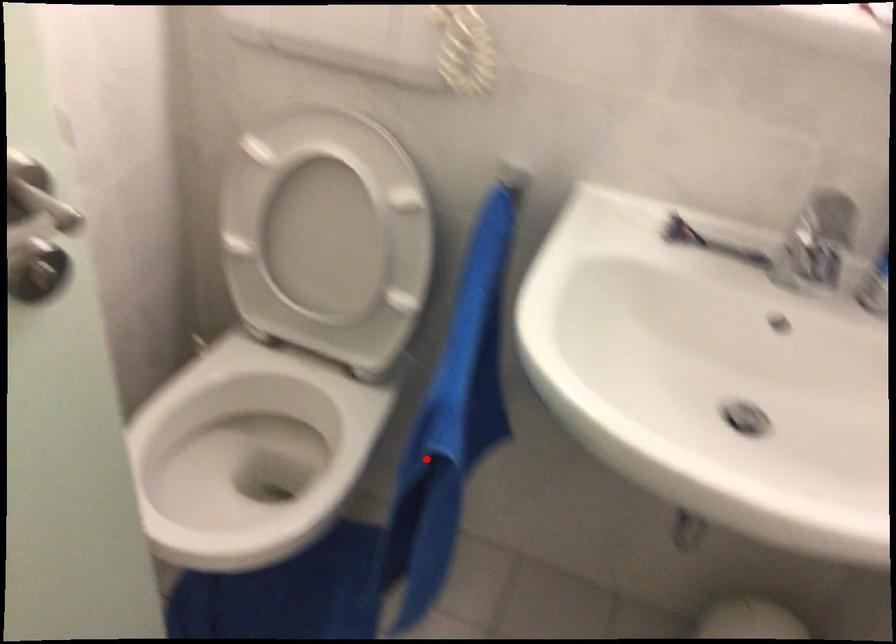
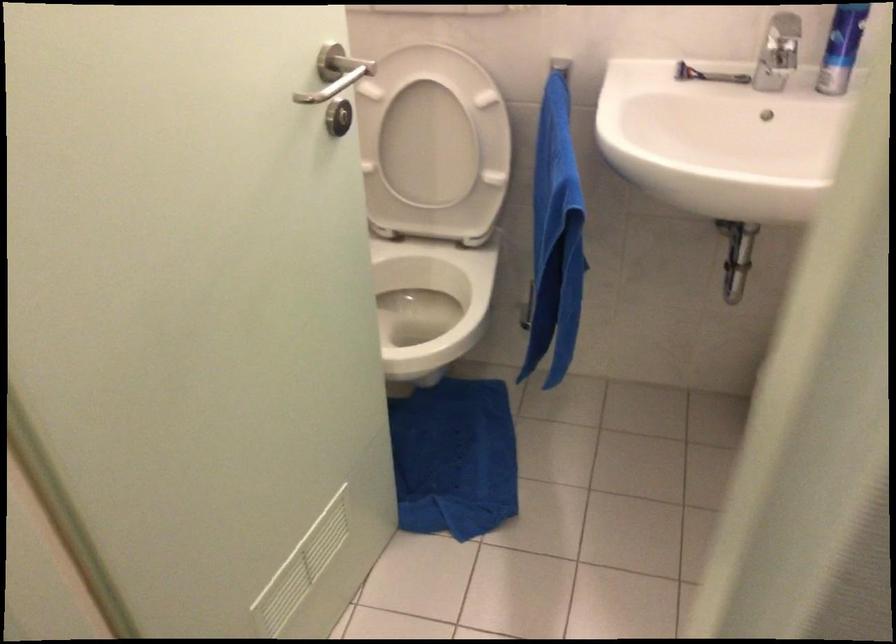
Locate, in the second image, the point that corresponds to the highlighted location in the first image.

(555, 238)